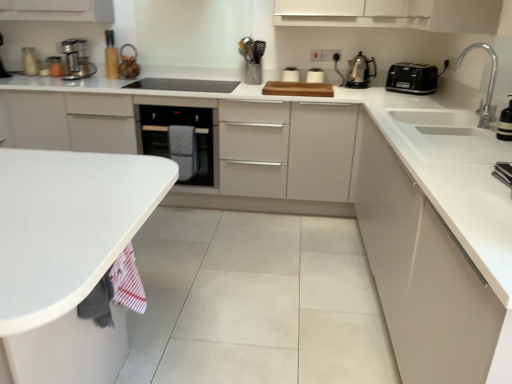
Question: Could you tell me if black plastic toaster at upper right, the 1th kitchen appliance when ordered from right to left, is turned towards polished stainless steel kettle at upper right, placed as the second kitchen appliance when sorted from left to right?

Choices:
 (A) no
 (B) yes

Answer: (A)

Question: From the image's perspective, does black plastic toaster at upper right, the 1th kitchen appliance when ordered from right to left, appear higher than polished stainless steel kettle at upper right, placed as the second kitchen appliance when sorted from left to right?

Choices:
 (A) no
 (B) yes

Answer: (A)

Question: Is black plastic toaster at upper right, the 1th kitchen appliance when ordered from right to left, completely or partially outside of polished stainless steel kettle at upper right, placed as the second kitchen appliance when sorted from left to right?

Choices:
 (A) yes
 (B) no

Answer: (A)

Question: Does black plastic toaster at upper right, the 1th kitchen appliance when ordered from right to left, contain polished stainless steel kettle at upper right, placed as the second kitchen appliance when sorted from left to right?

Choices:
 (A) no
 (B) yes

Answer: (A)

Question: Can you confirm if black plastic toaster at upper right, the 1th kitchen appliance when ordered from right to left, is wider than polished stainless steel kettle at upper right, placed as the second kitchen appliance when sorted from left to right?

Choices:
 (A) yes
 (B) no

Answer: (A)

Question: Visually, is white matte countertop at lower left positioned to the left or to the right of white glossy toaster at upper center, arranged as the fifth appliance when ordered from the bottom?

Choices:
 (A) right
 (B) left

Answer: (B)

Question: In terms of width, does white matte countertop at lower left look wider or thinner when compared to white glossy toaster at upper center, marked as the 1th appliance in a back-to-front arrangement?

Choices:
 (A) thin
 (B) wide

Answer: (B)

Question: Considering their positions, is white matte countertop at lower left located in front of or behind white glossy toaster at upper center, acting as the 3th appliance starting from the left?

Choices:
 (A) front
 (B) behind

Answer: (A)

Question: Considering the positions of white matte countertop at lower left and white glossy toaster at upper center, the second appliance viewed from the top, in the image, is white matte countertop at lower left taller or shorter than white glossy toaster at upper center, the second appliance viewed from the top,?

Choices:
 (A) tall
 (B) short

Answer: (A)

Question: From the image's perspective, relative to metallic silver toaster at upper right, the 5th appliance in the left-to-right sequence, is black plastic toaster at upper right, the 1th kitchen appliance when ordered from right to left, above or below?

Choices:
 (A) above
 (B) below

Answer: (A)

Question: Does point (426, 69) appear closer or farther from the camera than point (507, 173)?

Choices:
 (A) closer
 (B) farther

Answer: (B)

Question: Considering the positions of black plastic toaster at upper right, which is the third kitchen appliance from left to right, and metallic silver toaster at upper right, which appears as the 2th appliance when viewed from the right, in the image, is black plastic toaster at upper right, which is the third kitchen appliance from left to right, wider or thinner than metallic silver toaster at upper right, which appears as the 2th appliance when viewed from the right,?

Choices:
 (A) wide
 (B) thin

Answer: (A)

Question: Considering the positions of black plastic toaster at upper right, the 1th kitchen appliance when ordered from right to left, and metallic silver toaster at upper right, the 1th appliance viewed from the front, in the image, is black plastic toaster at upper right, the 1th kitchen appliance when ordered from right to left, taller or shorter than metallic silver toaster at upper right, the 1th appliance viewed from the front,?

Choices:
 (A) tall
 (B) short

Answer: (A)

Question: Considering the positions of black plastic toaster at upper right, which is the third kitchen appliance from left to right, and white glossy sink at right in the image, is black plastic toaster at upper right, which is the third kitchen appliance from left to right, wider or thinner than white glossy sink at right?

Choices:
 (A) thin
 (B) wide

Answer: (A)

Question: Considering the positions of point (432, 91) and point (451, 125), is point (432, 91) closer or farther from the camera than point (451, 125)?

Choices:
 (A) closer
 (B) farther

Answer: (B)